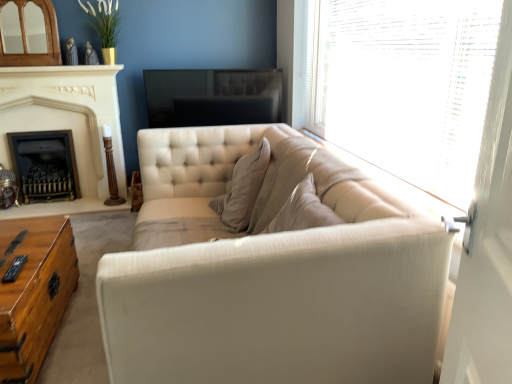
What do you see at coordinates (404, 85) in the screenshot? This screenshot has width=512, height=384. I see `translucent wood blinds at upper right` at bounding box center [404, 85].

This screenshot has height=384, width=512. I want to click on translucent wood blinds at upper right, so click(x=404, y=85).

Describe the element at coordinates (34, 292) in the screenshot. I see `wooden trunk at lower left` at that location.

This screenshot has width=512, height=384. Describe the element at coordinates (66, 126) in the screenshot. I see `white stone fireplace at left, positioned as the 1th fireplace in right-to-left order` at that location.

Identify the location of satin beige couch at center. Image resolution: width=512 pixels, height=384 pixels. (268, 279).

Based on the photo, is black metal fireplace at left, the second fireplace from the right, next to satin beige couch at center?

No, black metal fireplace at left, the second fireplace from the right, is not beside satin beige couch at center.

Considering the relative sizes of black metal fireplace at left, the second fireplace from the right, and satin beige couch at center in the image provided, is black metal fireplace at left, the second fireplace from the right, bigger than satin beige couch at center?

Incorrect, black metal fireplace at left, the second fireplace from the right, is not larger than satin beige couch at center.

I want to click on fireplace below the satin beige couch at center (from a real-world perspective), so click(44, 165).

Does black metal fireplace at left, positioned as the first fireplace in left-to-right order, have a greater height compared to satin beige couch at center?

In fact, black metal fireplace at left, positioned as the first fireplace in left-to-right order, may be shorter than satin beige couch at center.

Is white stone fireplace at left, the 2th fireplace in the left-to-right sequence, at the right side of satin beige couch at center?

In fact, white stone fireplace at left, the 2th fireplace in the left-to-right sequence, is to the left of satin beige couch at center.

Looking at this image, from the image's perspective, is white stone fireplace at left, the 2th fireplace in the left-to-right sequence, on top of satin beige couch at center?

Yes.

Is white stone fireplace at left, the 2th fireplace in the left-to-right sequence, touching satin beige couch at center?

No, white stone fireplace at left, the 2th fireplace in the left-to-right sequence, is not touching satin beige couch at center.

Consider the image. Considering the relative sizes of wooden trunk at lower left and white stone fireplace at left, the 2th fireplace in the left-to-right sequence, in the image provided, is wooden trunk at lower left smaller than white stone fireplace at left, the 2th fireplace in the left-to-right sequence,?

No, wooden trunk at lower left is not smaller than white stone fireplace at left, the 2th fireplace in the left-to-right sequence.

Measure the distance from wooden trunk at lower left to white stone fireplace at left, positioned as the 1th fireplace in right-to-left order.

wooden trunk at lower left and white stone fireplace at left, positioned as the 1th fireplace in right-to-left order, are 4.94 feet apart.

Is there a large distance between wooden trunk at lower left and white stone fireplace at left, positioned as the 1th fireplace in right-to-left order?

wooden trunk at lower left is far away from white stone fireplace at left, positioned as the 1th fireplace in right-to-left order.

From the picture: Is wooden trunk at lower left at the right side of white stone fireplace at left, the 2th fireplace in the left-to-right sequence?

Yes, wooden trunk at lower left is to the right of white stone fireplace at left, the 2th fireplace in the left-to-right sequence.

Can you confirm if wooden trunk at lower left is bigger than translucent wood blinds at upper right?

Indeed, wooden trunk at lower left has a larger size compared to translucent wood blinds at upper right.

Is translucent wood blinds at upper right at the back of wooden trunk at lower left?

No, wooden trunk at lower left is not facing the opposite direction of translucent wood blinds at upper right.

At what (x,y) coordinates should I click in order to perform the action: click on window on the right of wooden trunk at lower left. Please return your answer as a coordinate pair (x, y). The image size is (512, 384). Looking at the image, I should click on click(x=404, y=85).

Does wooden trunk at lower left come behind translucent wood blinds at upper right?

Yes.

How different are the orientations of translucent wood blinds at upper right and black metal fireplace at left, the second fireplace from the right, in degrees?

translucent wood blinds at upper right and black metal fireplace at left, the second fireplace from the right, are facing 91.1 degrees away from each other.

Is translucent wood blinds at upper right looking in the opposite direction of black metal fireplace at left, the second fireplace from the right?

No, translucent wood blinds at upper right is not facing away from black metal fireplace at left, the second fireplace from the right.

Is translucent wood blinds at upper right wider or thinner than black metal fireplace at left, the second fireplace from the right?

translucent wood blinds at upper right is thinner than black metal fireplace at left, the second fireplace from the right.

Is translucent wood blinds at upper right touching black metal fireplace at left, the second fireplace from the right?

No, translucent wood blinds at upper right is not making contact with black metal fireplace at left, the second fireplace from the right.

From their relative heights in the image, would you say satin beige couch at center is taller or shorter than black metal fireplace at left, positioned as the first fireplace in left-to-right order?

Clearly, satin beige couch at center is taller compared to black metal fireplace at left, positioned as the first fireplace in left-to-right order.

Are satin beige couch at center and black metal fireplace at left, positioned as the first fireplace in left-to-right order, making contact?

satin beige couch at center and black metal fireplace at left, positioned as the first fireplace in left-to-right order, are not in contact.

Which object is wider, satin beige couch at center or black metal fireplace at left, the second fireplace from the right?

Wider between the two is satin beige couch at center.

Could you tell me if satin beige couch at center is turned towards translucent wood blinds at upper right?

No, satin beige couch at center is not aimed at translucent wood blinds at upper right.

Which is more to the right, satin beige couch at center or translucent wood blinds at upper right?

translucent wood blinds at upper right is more to the right.

Between satin beige couch at center and translucent wood blinds at upper right, which one is positioned in front?

Positioned in front is translucent wood blinds at upper right.

Is point (338, 301) closer to viewer compared to point (388, 85)?

Yes.

I want to click on studio couch located on the right of black metal fireplace at left, positioned as the first fireplace in left-to-right order, so click(x=268, y=279).

The height and width of the screenshot is (384, 512). I want to click on the 2nd fireplace above the satin beige couch at center (from the image's perspective), so click(66, 126).

Based on their spatial positions, is white stone fireplace at left, the 2th fireplace in the left-to-right sequence, or translucent wood blinds at upper right closer to satin beige couch at center?

Based on the image, translucent wood blinds at upper right appears to be nearer to satin beige couch at center.

When comparing their distances from satin beige couch at center, does wooden trunk at lower left or translucent wood blinds at upper right seem further?

wooden trunk at lower left is positioned further to the anchor satin beige couch at center.

Based on their spatial positions, is white stone fireplace at left, the 2th fireplace in the left-to-right sequence, or black metal fireplace at left, positioned as the first fireplace in left-to-right order, closer to translucent wood blinds at upper right?

The object closer to translucent wood blinds at upper right is white stone fireplace at left, the 2th fireplace in the left-to-right sequence.

Looking at this image, from the image, which object appears to be farther from black metal fireplace at left, positioned as the first fireplace in left-to-right order, wooden trunk at lower left or translucent wood blinds at upper right?

translucent wood blinds at upper right.

When comparing their distances from satin beige couch at center, does wooden trunk at lower left or white stone fireplace at left, positioned as the 1th fireplace in right-to-left order, seem further?

Among the two, white stone fireplace at left, positioned as the 1th fireplace in right-to-left order, is located further to satin beige couch at center.

Looking at the image, which one is located further to wooden trunk at lower left, satin beige couch at center or white stone fireplace at left, positioned as the 1th fireplace in right-to-left order?

white stone fireplace at left, positioned as the 1th fireplace in right-to-left order, is further to wooden trunk at lower left.

Based on their spatial positions, is satin beige couch at center or translucent wood blinds at upper right further from black metal fireplace at left, positioned as the first fireplace in left-to-right order?

Among the two, satin beige couch at center is located further to black metal fireplace at left, positioned as the first fireplace in left-to-right order.

Based on their spatial positions, is black metal fireplace at left, positioned as the first fireplace in left-to-right order, or translucent wood blinds at upper right closer to white stone fireplace at left, the 2th fireplace in the left-to-right sequence?

black metal fireplace at left, positioned as the first fireplace in left-to-right order, is positioned closer to the anchor white stone fireplace at left, the 2th fireplace in the left-to-right sequence.

Identify the location of fireplace positioned between wooden trunk at lower left and black metal fireplace at left, positioned as the first fireplace in left-to-right order, from near to far. (66, 126).

This screenshot has height=384, width=512. In order to click on studio couch located between wooden trunk at lower left and translucent wood blinds at upper right in the left-right direction in this screenshot , I will do `click(268, 279)`.

This screenshot has width=512, height=384. I want to click on studio couch between wooden trunk at lower left and black metal fireplace at left, the second fireplace from the right, in the front-back direction, so click(x=268, y=279).

Find the location of a particular element. Image resolution: width=512 pixels, height=384 pixels. studio couch situated between white stone fireplace at left, the 2th fireplace in the left-to-right sequence, and translucent wood blinds at upper right from left to right is located at coordinates (268, 279).